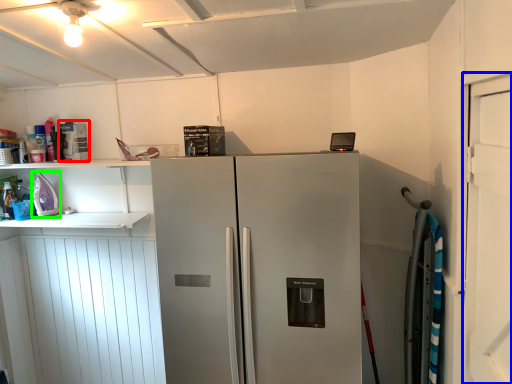
Question: Estimate the real-world distances between objects in this image. Which object is farther from appliance (highlighted by a red box), door (highlighted by a blue box) or appliance (highlighted by a green box)?

Choices:
 (A) door
 (B) appliance

Answer: (A)